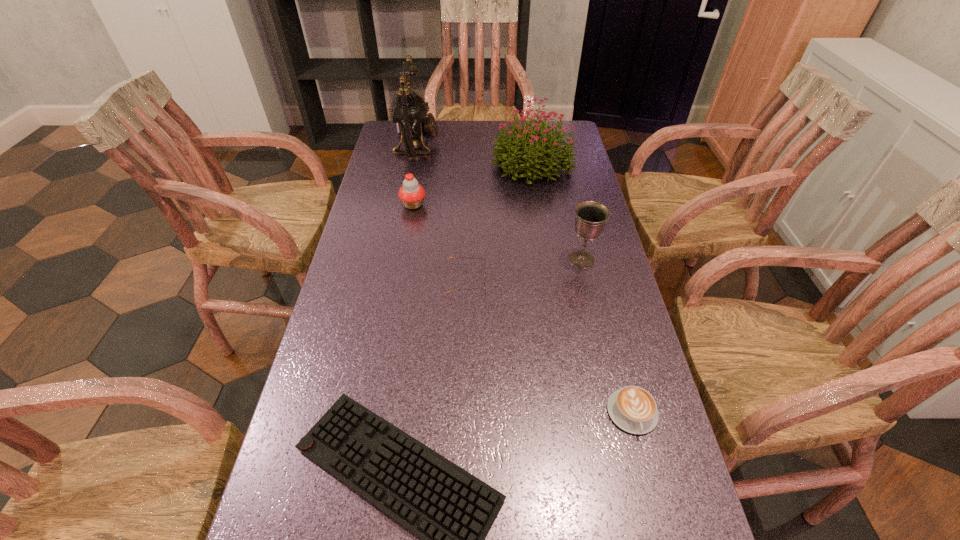
The width and height of the screenshot is (960, 540). Find the location of `the tallest object`. the tallest object is located at coordinates (411, 116).

Where is `bouquet`? The height and width of the screenshot is (540, 960). bouquet is located at coordinates (519, 140).

The width and height of the screenshot is (960, 540). I want to click on the third tallest object, so click(x=591, y=216).

In order to click on cupcake in this screenshot , I will do `click(411, 194)`.

The image size is (960, 540). What are the coordinates of `the fourth shortest object` in the screenshot? It's located at click(x=411, y=194).

Identify the location of the fifth tallest object. Image resolution: width=960 pixels, height=540 pixels. (450, 257).

This screenshot has height=540, width=960. What are the coordinates of `the second shortest object` in the screenshot? It's located at (632, 408).

Locate an element on the screen. vacant space situated on the rotary dial of the telephone is located at coordinates (512, 145).

The image size is (960, 540). I want to click on free spot located 0.250m on the front of the bouquet, so click(x=545, y=238).

The width and height of the screenshot is (960, 540). I want to click on vacant space located on the back of the third tallest object, so click(575, 233).